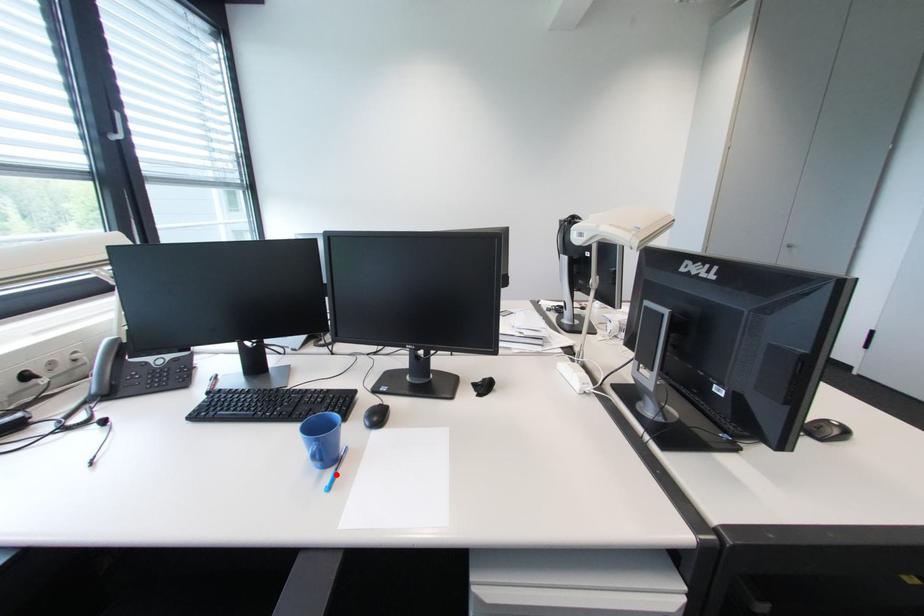
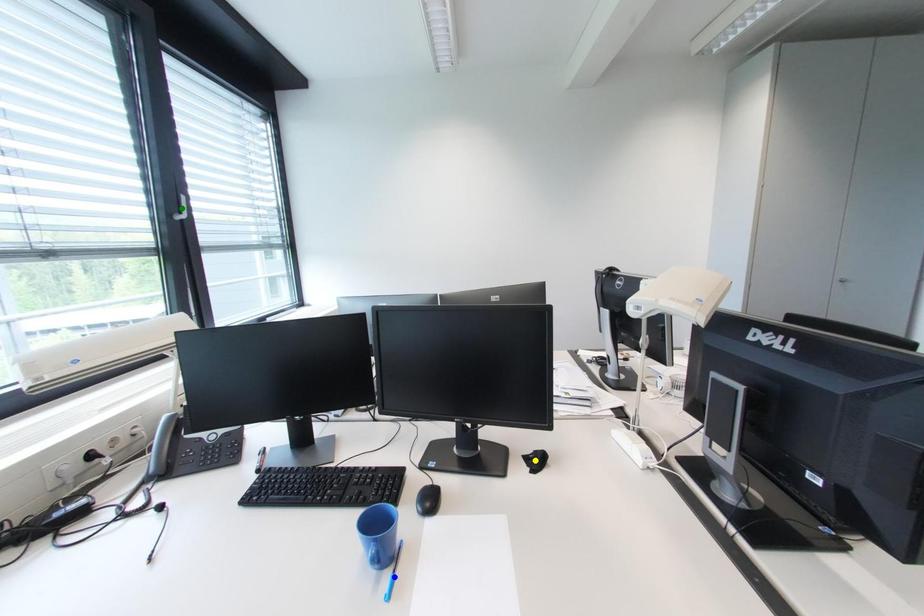
Question: I am providing you with two images of the same scene from different viewpoints. A red point is marked on the first image. You are given multiple points on the second image. Which spot in image 2 lines up with the point in image 1?

Choices:
 (A) yellow point
 (B) blue point
 (C) green point

Answer: (B)